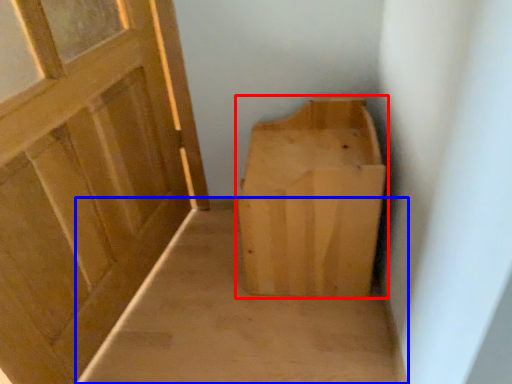
Question: Among these objects, which one is farthest to the camera, furniture (highlighted by a red box) or plain (highlighted by a blue box)?

Choices:
 (A) furniture
 (B) plain

Answer: (B)